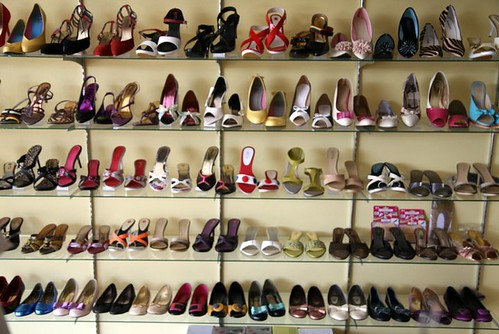
The image size is (499, 334). Identify the location of shelf. (255, 57), (260, 128), (280, 190), (312, 257), (333, 318).